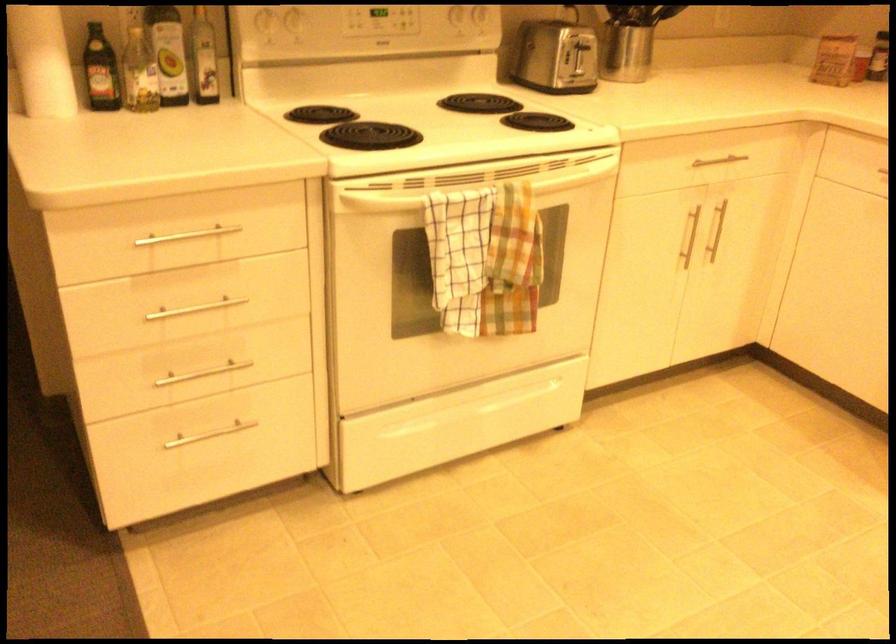
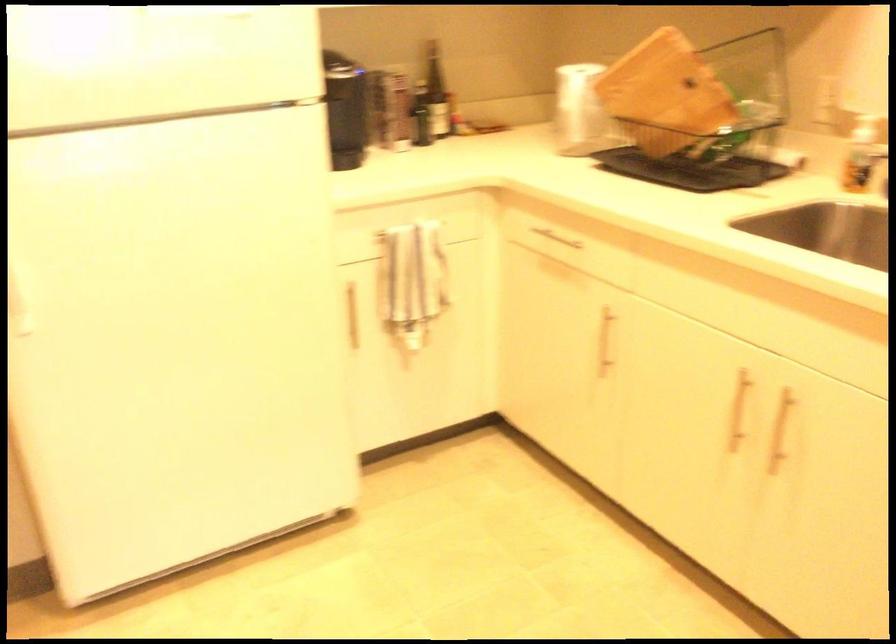
First-person continuous shooting, in which direction is the camera rotating?

The camera's rotation is toward right-down.